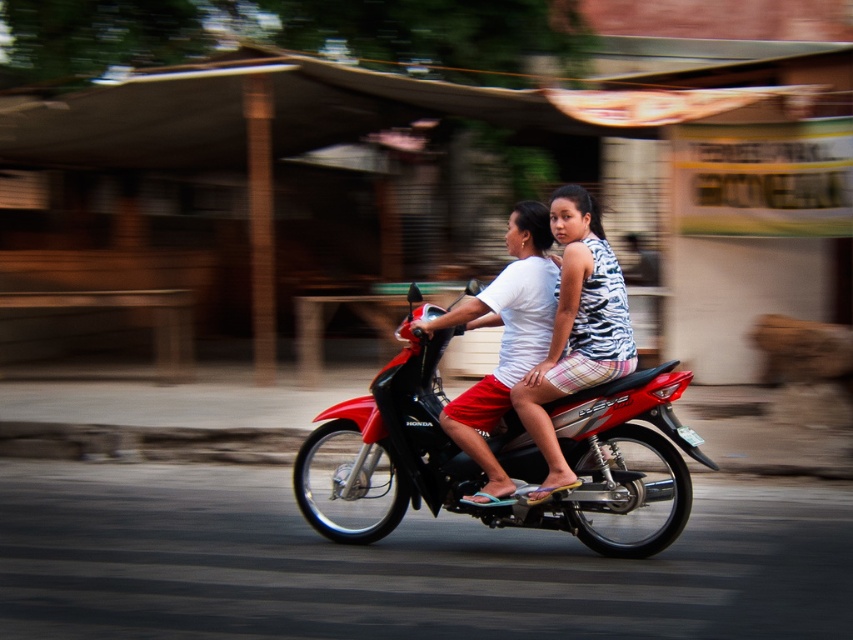
Can you confirm if shiny red motorcycle at center is thinner than patterned fabric shirt at center?

No.

Can you confirm if shiny red motorcycle at center is shorter than patterned fabric shirt at center?

Indeed, shiny red motorcycle at center has a lesser height compared to patterned fabric shirt at center.

Which is behind, point (570, 445) or point (602, 269)?

Positioned behind is point (570, 445).

Find the location of a particular element. The image size is (853, 640). shiny red motorcycle at center is located at coordinates (479, 465).

Which of these two, shiny red motorcycle at center or white matte shirt at center, stands shorter?

shiny red motorcycle at center

Can you confirm if shiny red motorcycle at center is positioned above white matte shirt at center?

No, shiny red motorcycle at center is not above white matte shirt at center.

Measure the distance between point (x=635, y=515) and camera.

Point (x=635, y=515) and camera are 7.96 meters apart from each other.

At what (x,y) coordinates should I click in order to perform the action: click on shiny red motorcycle at center. Please return your answer as a coordinate pair (x, y). Looking at the image, I should click on (479, 465).

Does point (579, 202) lie behind point (465, 397)?

That is False.

Where is `patterned fabric shirt at center`? The image size is (853, 640). patterned fabric shirt at center is located at coordinates pyautogui.click(x=576, y=330).

This screenshot has width=853, height=640. I want to click on patterned fabric shirt at center, so click(576, 330).